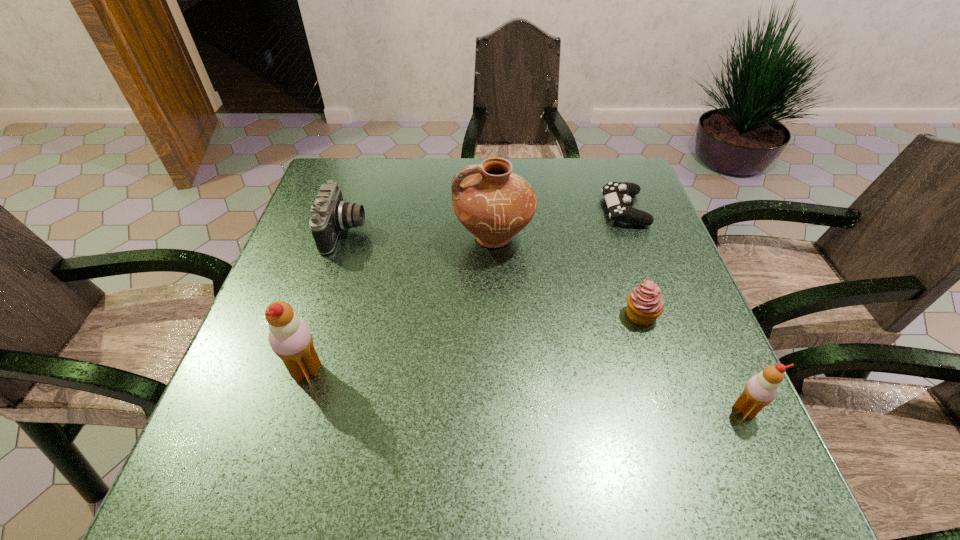
Where is `vacant region at the right edge of the desktop`? The image size is (960, 540). vacant region at the right edge of the desktop is located at coordinates (691, 353).

In the image, there is a desktop. Where is `vacant space at the far left corner`? This screenshot has width=960, height=540. vacant space at the far left corner is located at coordinates (372, 194).

You are a GUI agent. You are given a task and a screenshot of the screen. Output one action in this format:
    pyautogui.click(x=<x>, y=<y>)
    Task: Click on the vacant area at the near left corner of the desktop
    
    Given the screenshot: What is the action you would take?
    pyautogui.click(x=233, y=409)

The height and width of the screenshot is (540, 960). What are the coordinates of `vacant space that is in between the pottery and the rightmost object` in the screenshot? It's located at (619, 323).

In order to click on blank region between the fourth farthest object and the farther icecream in this screenshot , I will do `click(474, 343)`.

Locate an element on the screen. free spot between the shortest object and the farther icecream is located at coordinates pyautogui.click(x=466, y=291).

Where is `free space between the fourth shortest object and the third nearest object`? The height and width of the screenshot is (540, 960). free space between the fourth shortest object and the third nearest object is located at coordinates coord(692,362).

This screenshot has width=960, height=540. Identify the location of vacant space that is in between the control and the shorter icecream. (684, 309).

Locate an element on the screen. The width and height of the screenshot is (960, 540). empty space between the camera and the fourth object from right to left is located at coordinates (420, 234).

At what (x,y) coordinates should I click in order to perform the action: click on vacant region between the camera and the third object from left to right. Please return your answer as a coordinate pair (x, y). Looking at the image, I should click on (420, 234).